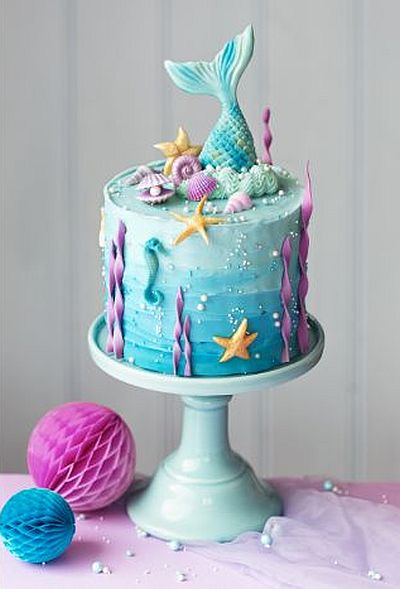
You are a GUI agent. You are given a task and a screenshot of the screen. Output one action in this format:
    pyautogui.click(x=<x>, y=<y>)
    Task: Click on the twisted purple decoratives
    This screenshot has height=589, width=400.
    Given the screenshot: What is the action you would take?
    pyautogui.click(x=110, y=292), pyautogui.click(x=120, y=307), pyautogui.click(x=173, y=368), pyautogui.click(x=187, y=370), pyautogui.click(x=287, y=312), pyautogui.click(x=305, y=267), pyautogui.click(x=268, y=138)